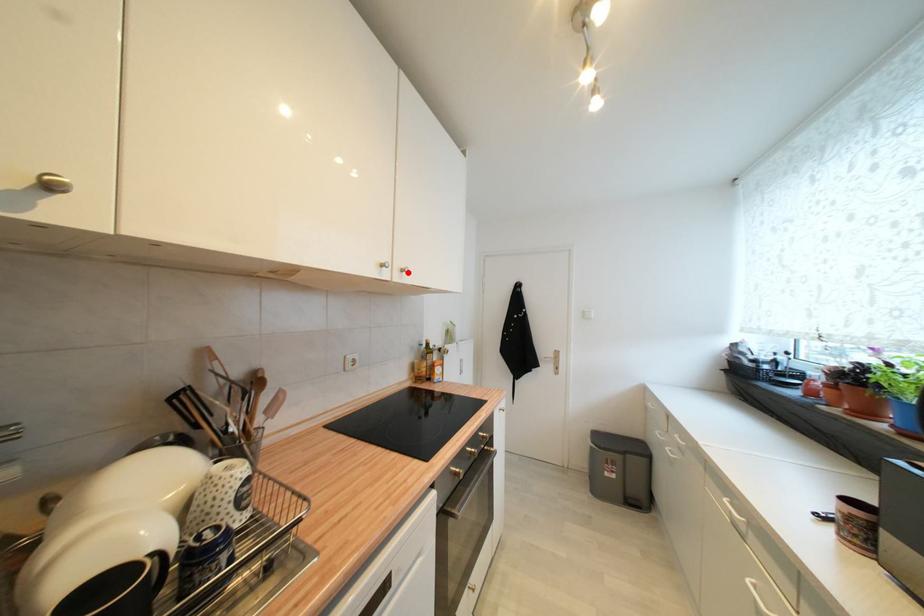
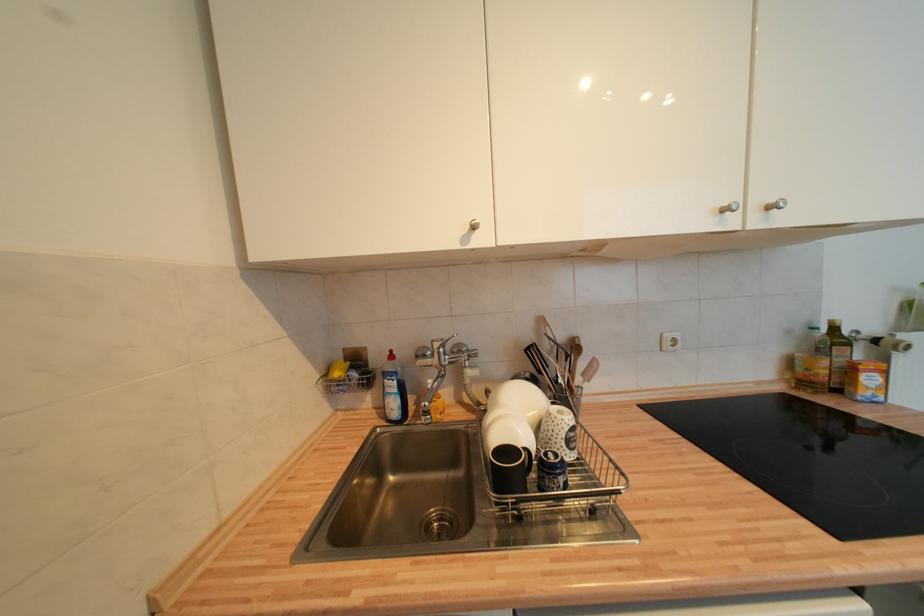
Find the pixel in the second image that matches the highlighted location in the first image.

(775, 209)